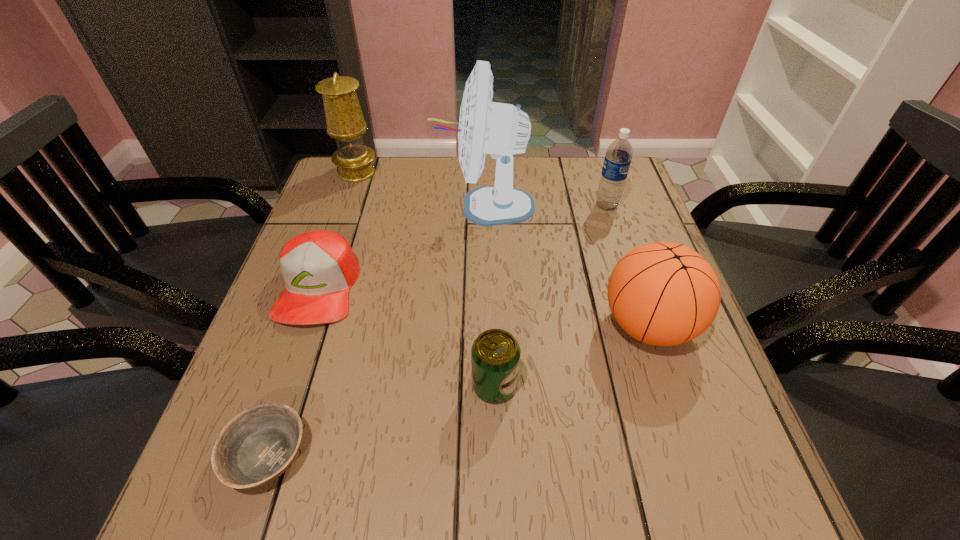
Locate an element on the screen. The image size is (960, 540). object at the near edge is located at coordinates (257, 446).

Identify the location of oil lamp that is at the left edge. This screenshot has width=960, height=540. (344, 118).

At what (x,y) coordinates should I click in order to perform the action: click on baseball cap located at the left edge. Please return your answer as a coordinate pair (x, y). The height and width of the screenshot is (540, 960). Looking at the image, I should click on (319, 267).

At what (x,y) coordinates should I click in order to perform the action: click on bowl at the left edge. Please return your answer as a coordinate pair (x, y). Looking at the image, I should click on (257, 446).

I want to click on water bottle located in the right edge section of the desktop, so click(x=618, y=156).

Identify the location of basketball that is at the right edge. (664, 294).

Find the location of a particular element. Image resolution: width=960 pixels, height=540 pixels. object that is at the far left corner is located at coordinates (344, 118).

This screenshot has width=960, height=540. Identify the location of object that is at the near left corner. (257, 446).

Where is `object at the far right corner`? This screenshot has width=960, height=540. object at the far right corner is located at coordinates (618, 156).

What are the coordinates of `vacant area at the far edge` in the screenshot? It's located at (556, 178).